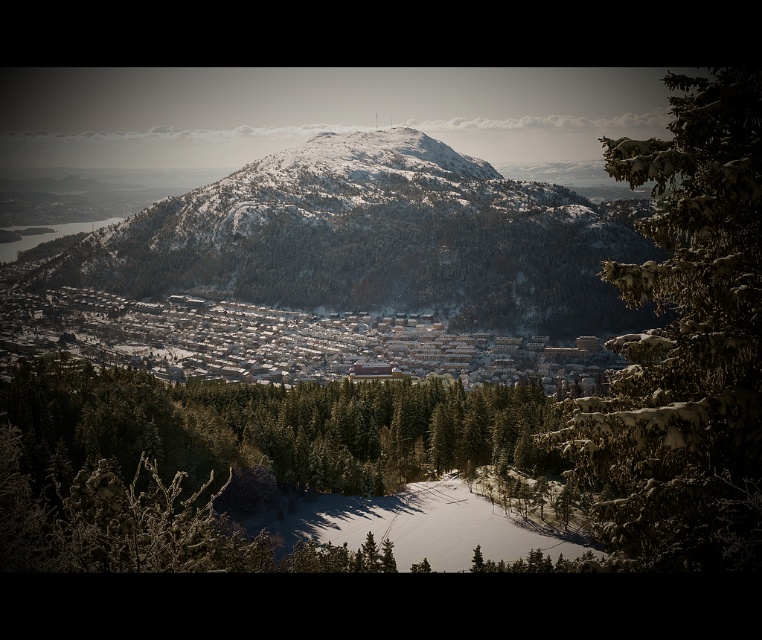
What do you see at coordinates (684, 346) in the screenshot?
I see `green textured pine tree at right` at bounding box center [684, 346].

Who is positioned more to the right, green textured pine tree at right or white snow-covered houses at center?

green textured pine tree at right

Does point (740, 426) come closer to viewer compared to point (280, 369)?

That is True.

Find the location of a particular element. green textured pine tree at right is located at coordinates (684, 346).

How distant is green textured pine tree at lower center from snow-covered mountain at center?

green textured pine tree at lower center is 136.68 meters away from snow-covered mountain at center.

What are the coordinates of `green textured pine tree at lower center` in the screenshot? It's located at (239, 465).

You are a GUI agent. You are given a task and a screenshot of the screen. Output one action in this format:
    pyautogui.click(x=<x>, y=<y>)
    Task: Click on the green textured pine tree at lower center
    The width and height of the screenshot is (762, 640).
    Given the screenshot: What is the action you would take?
    239,465

Who is lower down, green textured pine tree at lower center or white snow-covered houses at center?

green textured pine tree at lower center

Which is above, green textured pine tree at lower center or white snow-covered houses at center?

Positioned higher is white snow-covered houses at center.

Who is more distant from viewer, (x=7, y=529) or (x=8, y=305)?

Point (x=8, y=305)

You are a GUI agent. You are given a task and a screenshot of the screen. Output one action in this format:
    pyautogui.click(x=<x>, y=<y>)
    Task: Click on the green textured pine tree at lower center
    The width and height of the screenshot is (762, 640).
    Given the screenshot: What is the action you would take?
    pyautogui.click(x=239, y=465)